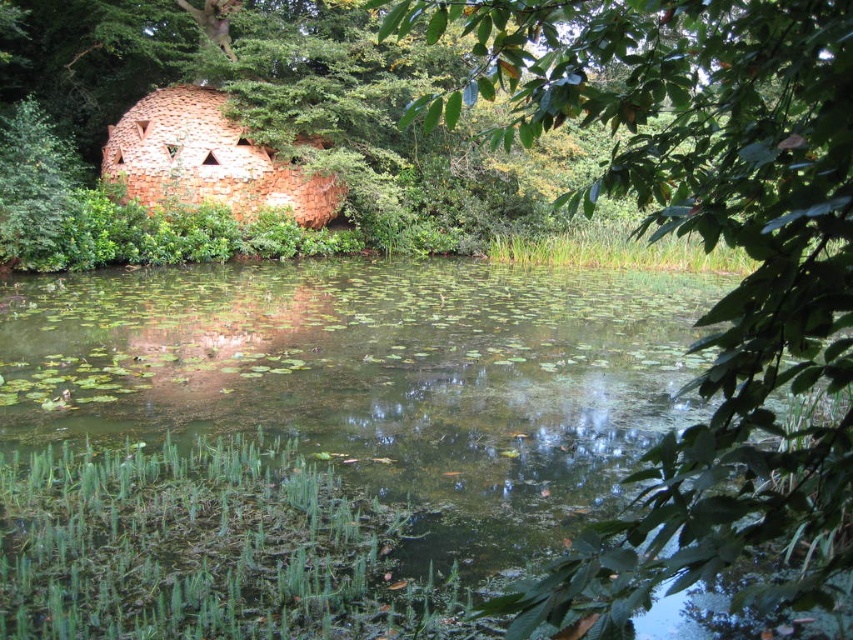
Can you confirm if green algae-covered water at center is bigger than green leafy tree at upper right?

No, green algae-covered water at center is not bigger than green leafy tree at upper right.

Which of these two, green algae-covered water at center or green leafy tree at upper right, stands taller?

With more height is green leafy tree at upper right.

Who is more distant from viewer, (494, 480) or (726, 186)?

The point (494, 480) is more distant.

This screenshot has width=853, height=640. Find the location of `green algae-covered water at center`. green algae-covered water at center is located at coordinates (x=378, y=378).